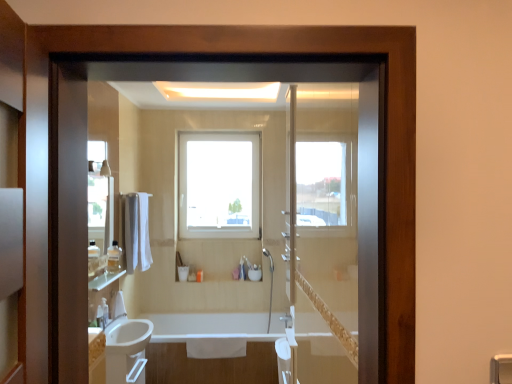
Question: Is clear plastic bottle at lower left, the 3th toiletry from the back, positioned far away from clear glass shelf at left?

Choices:
 (A) yes
 (B) no

Answer: (B)

Question: Does clear plastic bottle at lower left, the 3th toiletry from the back, appear on the left side of clear glass shelf at left?

Choices:
 (A) yes
 (B) no

Answer: (A)

Question: Considering the relative sizes of clear plastic bottle at lower left, which is counted as the 1th toiletry, starting from the front, and clear glass shelf at left in the image provided, is clear plastic bottle at lower left, which is counted as the 1th toiletry, starting from the front, shorter than clear glass shelf at left?

Choices:
 (A) yes
 (B) no

Answer: (B)

Question: Does clear plastic bottle at lower left, the 3th toiletry from the back, have a greater width compared to clear glass shelf at left?

Choices:
 (A) yes
 (B) no

Answer: (B)

Question: Considering the relative sizes of clear plastic bottle at lower left, positioned as the second toiletry in top-to-bottom order, and clear glass shelf at left in the image provided, is clear plastic bottle at lower left, positioned as the second toiletry in top-to-bottom order, taller than clear glass shelf at left?

Choices:
 (A) yes
 (B) no

Answer: (A)

Question: Can you confirm if clear plastic bottle at lower left, the 3th toiletry from the back, is thinner than clear glass shelf at left?

Choices:
 (A) no
 (B) yes

Answer: (B)

Question: Can you confirm if clear glass mirror at upper left is bigger than transparent glass window at center?

Choices:
 (A) no
 (B) yes

Answer: (A)

Question: Is transparent glass window at center surrounded by clear glass mirror at upper left?

Choices:
 (A) yes
 (B) no

Answer: (B)

Question: Can you confirm if clear glass mirror at upper left is wider than transparent glass window at center?

Choices:
 (A) no
 (B) yes

Answer: (A)

Question: Is clear glass mirror at upper left further to the viewer compared to transparent glass window at center?

Choices:
 (A) yes
 (B) no

Answer: (B)

Question: Is clear glass mirror at upper left taller than transparent glass window at center?

Choices:
 (A) yes
 (B) no

Answer: (B)

Question: Does clear glass mirror at upper left lie in front of transparent glass window at center?

Choices:
 (A) no
 (B) yes

Answer: (B)

Question: Is clear plastic bottle at lower left, the 3th toiletry from the back, wider than clear glass mirror at upper left?

Choices:
 (A) yes
 (B) no

Answer: (A)